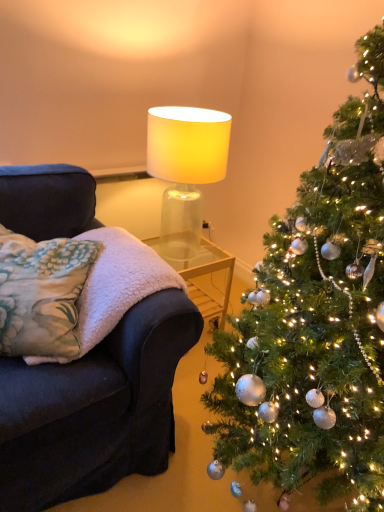
Question: Looking at their shapes, would you say translucent glass lampshade at upper center is wider or thinner than shiny silver ornaments at right?

Choices:
 (A) wide
 (B) thin

Answer: (B)

Question: Considering the positions of translucent glass lampshade at upper center and shiny silver ornaments at right in the image, is translucent glass lampshade at upper center bigger or smaller than shiny silver ornaments at right?

Choices:
 (A) small
 (B) big

Answer: (A)

Question: Which object is the farthest from the fluffy floral pillow at left?

Choices:
 (A) fluffy white blanket at left
 (B) translucent glass lampshade at upper center
 (C) shiny silver ornaments at right

Answer: (B)

Question: Considering the real-world distances, which object is closest to the fluffy white blanket at left?

Choices:
 (A) translucent glass lampshade at upper center
 (B) fluffy floral pillow at left
 (C) shiny silver ornaments at right

Answer: (B)